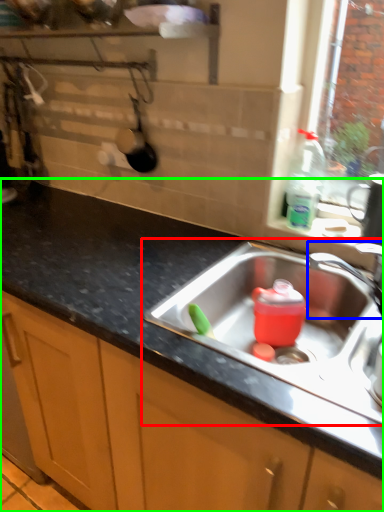
Question: Based on their relative distances, which object is farther from sink (highlighted by a red box)? Choose from tap (highlighted by a blue box) and countertop (highlighted by a green box).

Choices:
 (A) tap
 (B) countertop

Answer: (B)